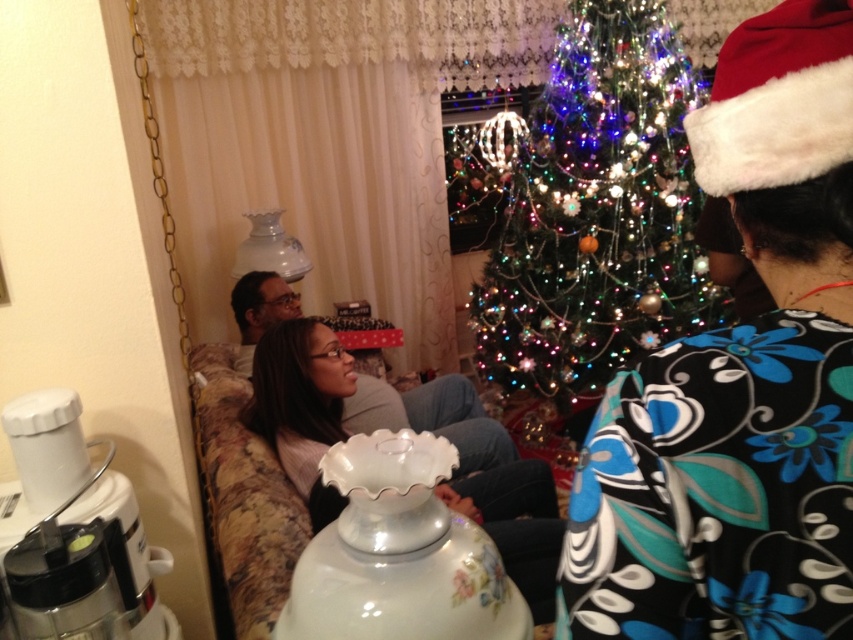
You are standing in the living room and want to move from point A to point B. Point A is at coordinates point(721, 621) and point B is at coordinates point(120, 518). According to the scene description, which point is closer to the camera?

Point(721, 621) is in front of point(120, 518), so it is closer to the camera.